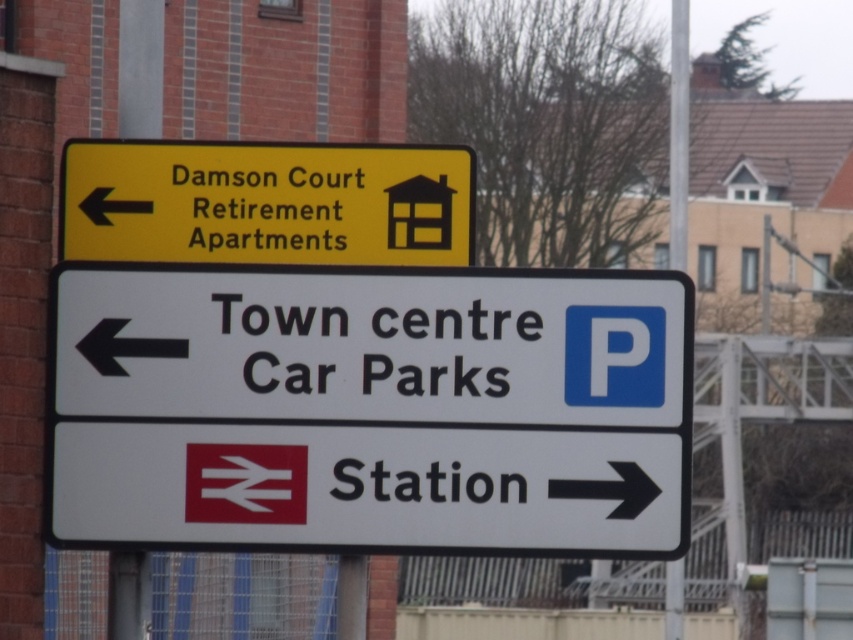
Question: Can you confirm if yellow matte sign at upper left is wider than white plastic pole at upper center?

Choices:
 (A) yes
 (B) no

Answer: (B)

Question: Can you confirm if white plastic sign at left is bigger than white plastic pole at upper center?

Choices:
 (A) no
 (B) yes

Answer: (A)

Question: Which point is farther from the camera taking this photo?

Choices:
 (A) (349, 362)
 (B) (677, 74)

Answer: (B)

Question: Can you confirm if yellow matte sign at upper left is thinner than white plastic pole at upper center?

Choices:
 (A) no
 (B) yes

Answer: (B)

Question: Which object is closer to the camera taking this photo?

Choices:
 (A) yellow matte sign at upper left
 (B) white plastic pole at upper center

Answer: (B)

Question: Which of the following is the farthest from the observer?

Choices:
 (A) (688, 99)
 (B) (469, 410)
 (C) (90, 140)

Answer: (A)